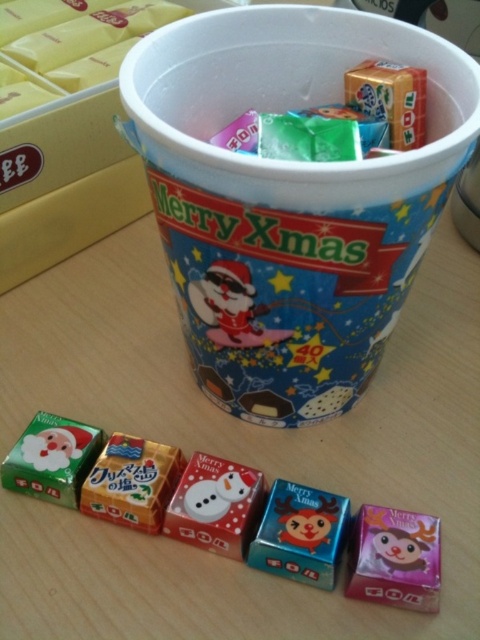
Question: Which point is closer to the camera?

Choices:
 (A) white plastic cup at center
 (B) matte plastic box at center
 (C) matte plastic cup at upper center
 (D) purple glossy box at lower right

Answer: (A)

Question: Does shiny blue plastic candy at center lie in front of matte plastic box at center?

Choices:
 (A) yes
 (B) no

Answer: (A)

Question: Can you confirm if white plastic cup at center is bigger than santa claus figure at center?

Choices:
 (A) no
 (B) yes

Answer: (B)

Question: Can you confirm if matte plastic cup at upper center is positioned to the right of shiny blue plastic candy at center?

Choices:
 (A) yes
 (B) no

Answer: (B)

Question: Which object is closer to the camera taking this photo?

Choices:
 (A) matte plastic cup at upper center
 (B) white plastic cup at center

Answer: (B)

Question: Estimate the real-world distances between objects in this image. Which object is closer to the wooden table at center?

Choices:
 (A) green matte santa claus at left
 (B) santa claus figure at center
 (C) matte plastic cup at upper center
 (D) metallic blue candy at center

Answer: (A)